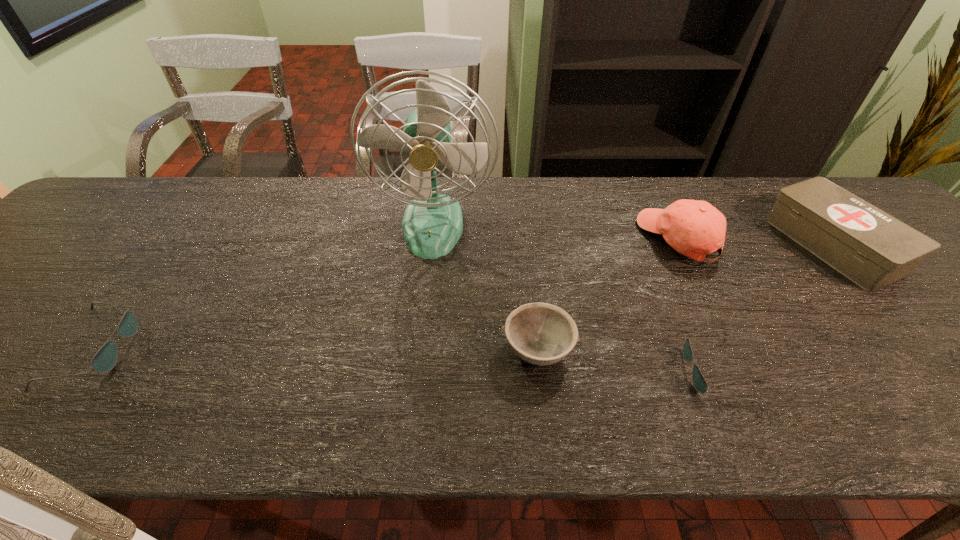
Identify the location of bowl present at the near edge. (542, 334).

Where is `object located at the right edge`? Image resolution: width=960 pixels, height=540 pixels. object located at the right edge is located at coordinates (873, 249).

Identify the location of object at the far right corner. (873, 249).

You are a GUI agent. You are given a task and a screenshot of the screen. Output one action in this format:
    pyautogui.click(x=<x>, y=<y>)
    Task: Click on the vacant space at the far edge
    The image size is (960, 540).
    Given the screenshot: What is the action you would take?
    tap(400, 204)

Find the location of a particular element. free space at the near edge is located at coordinates (637, 354).

Where is `vacant space at the left edge of the desktop`? This screenshot has height=540, width=960. vacant space at the left edge of the desktop is located at coordinates (22, 348).

Locate an element on the screen. Image resolution: width=960 pixels, height=540 pixels. vacant area that lies between the third tallest object and the tallest object is located at coordinates (634, 235).

You are a GUI agent. You are given a task and a screenshot of the screen. Output one action in this format:
    pyautogui.click(x=<x>, y=<y>)
    Task: Click on the vacant area that lies between the taller sunglasses and the first-aid kit
    Image resolution: width=960 pixels, height=540 pixels.
    Given the screenshot: What is the action you would take?
    pyautogui.click(x=465, y=297)

You are a GUI agent. You are given a task and a screenshot of the screen. Output one action in this format:
    pyautogui.click(x=<x>, y=<y>)
    Task: Click on the unoccupied area between the bowl and the rightmost object
    Image resolution: width=960 pixels, height=540 pixels.
    Given the screenshot: What is the action you would take?
    pyautogui.click(x=685, y=298)

Image resolution: width=960 pixels, height=540 pixels. Identify the location of free point between the fifth tallest object and the fifth shortest object. (388, 294).